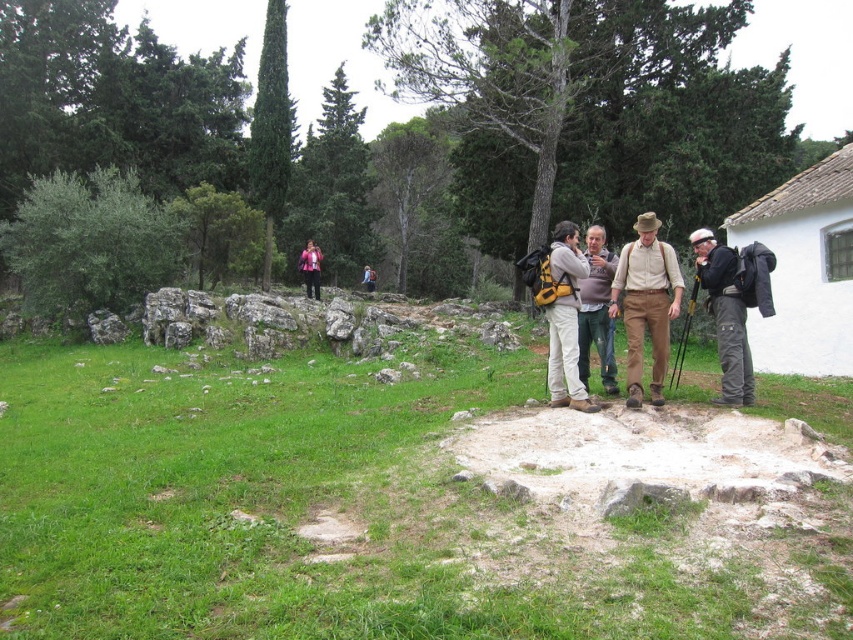
Question: Which point is farther from the camera taking this photo?

Choices:
 (A) (596, 408)
 (B) (741, 388)

Answer: (B)

Question: Does khaki cotton pants at center appear on the right side of light pink fabric at center?

Choices:
 (A) yes
 (B) no

Answer: (A)

Question: Which object is the farthest from the black backpack at right?

Choices:
 (A) matte khaki pants at center
 (B) khaki cotton pants at center
 (C) pink fabric jacket at center
 (D) light pink fabric at center

Answer: (D)

Question: Which point is closer to the camera?

Choices:
 (A) light pink fabric at center
 (B) matte khaki pants at center
 (C) khaki cotton pants at center

Answer: (B)

Question: Is the position of matte khaki pants at center less distant than that of pink fabric jacket at center?

Choices:
 (A) yes
 (B) no

Answer: (A)

Question: Does khaki cotton pants at center lie in front of gray rough stone at center?

Choices:
 (A) no
 (B) yes

Answer: (A)